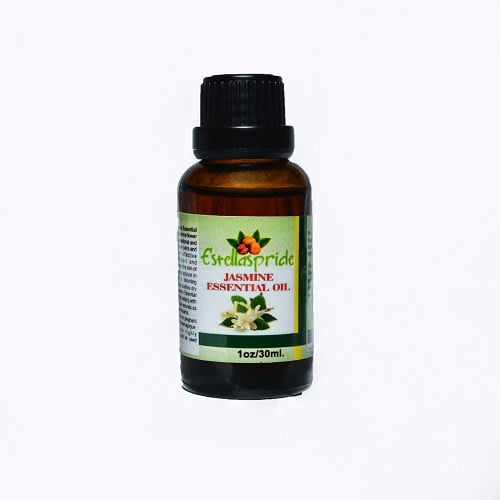
Find the location of a particular element. Image resolution: width=500 pixels, height=500 pixels. bottle is located at coordinates (286, 368).